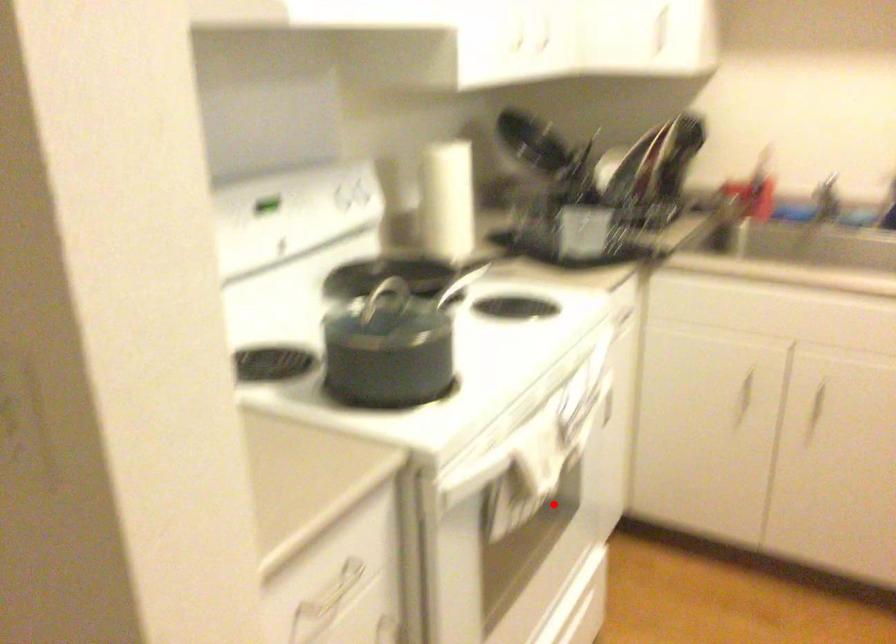
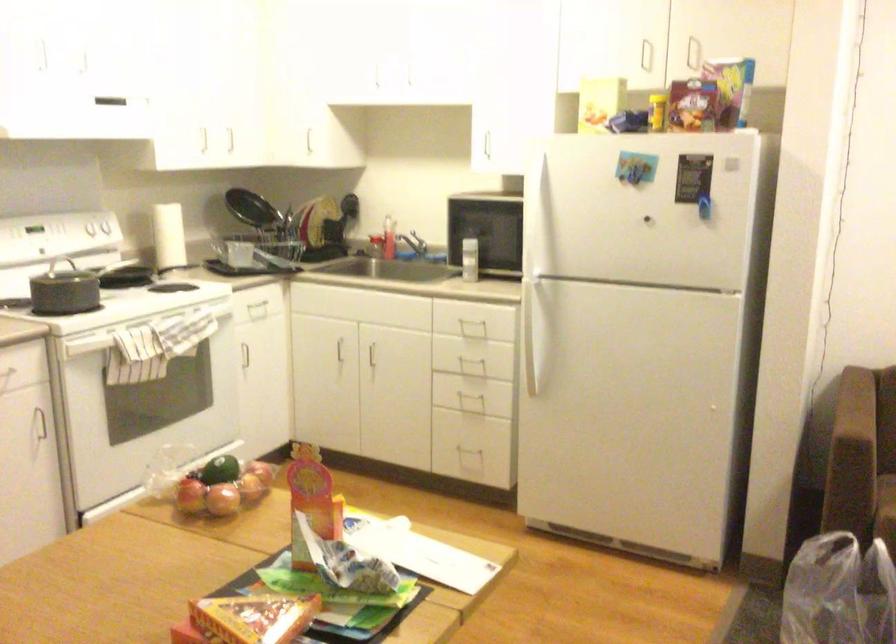
The point at the highlighted location is marked in the first image. Where is the corresponding point in the second image?

(174, 382)